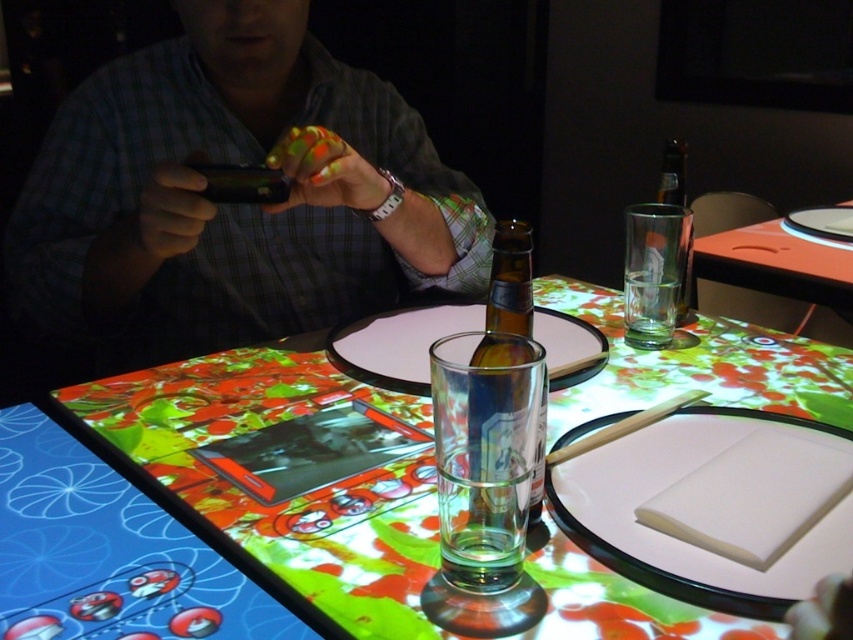
Question: Observing the image, what is the correct spatial positioning of brown glass bottle at center in reference to translucent glass bottle at upper right?

Choices:
 (A) above
 (B) below

Answer: (B)

Question: Which of the following is the farthest from the observer?

Choices:
 (A) translucent glass bottle at upper right
 (B) matte black phone at upper left
 (C) translucent glass beer bottle at center

Answer: (A)

Question: Can you confirm if matte black phone at upper left is wider than translucent glass bottle at upper right?

Choices:
 (A) no
 (B) yes

Answer: (B)

Question: Among these objects, which one is farthest from the camera?

Choices:
 (A) brown glass bottle at center
 (B) translucent glass beer bottle at center
 (C) translucent glass bottle at upper right

Answer: (C)

Question: Which object appears closest to the camera in this image?

Choices:
 (A) translucent glass beer bottle at center
 (B) brown glass bottle at center
 (C) matte black phone at upper left

Answer: (A)

Question: Does translucent glass beer bottle at center appear over brown glass bottle at center?

Choices:
 (A) yes
 (B) no

Answer: (B)